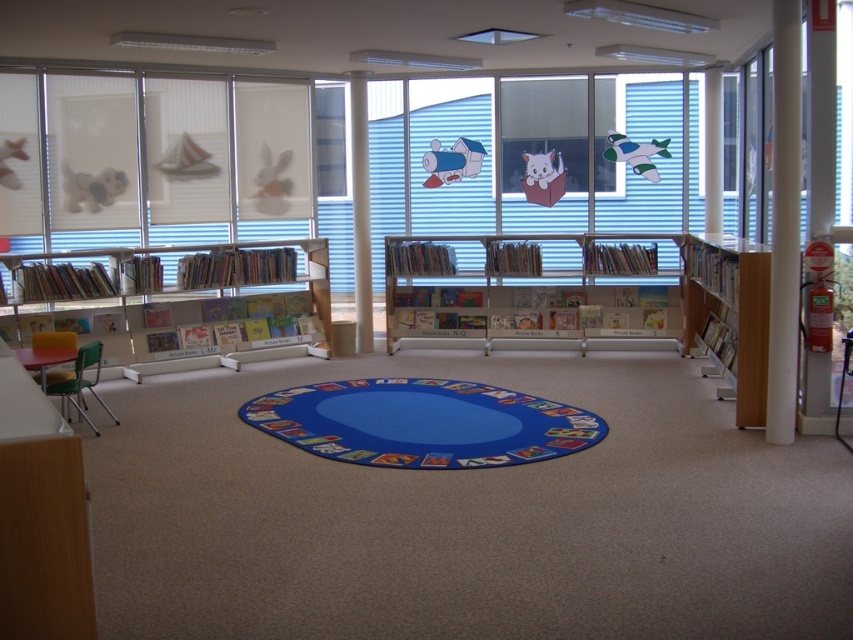
Who is lower down, matte white teddy bear at left or white matte rabbit at upper center?

Positioned lower is matte white teddy bear at left.

Locate an element on the screen. The image size is (853, 640). matte white teddy bear at left is located at coordinates (90, 188).

Find the location of a particular element. The image size is (853, 640). matte white teddy bear at left is located at coordinates (90, 188).

Does white plush cat at center lie in front of white matte sailboat at upper left?

That is False.

Can you confirm if white plush cat at center is positioned to the right of white matte sailboat at upper left?

Indeed, white plush cat at center is positioned on the right side of white matte sailboat at upper left.

I want to click on white plush cat at center, so click(543, 177).

Where is `white plush cat at center`? The width and height of the screenshot is (853, 640). white plush cat at center is located at coordinates (543, 177).

Who is shorter, matte plastic mouse at center or white matte rabbit at upper center?

With less height is matte plastic mouse at center.

Does matte plastic mouse at center have a larger size compared to white matte rabbit at upper center?

Correct, matte plastic mouse at center is larger in size than white matte rabbit at upper center.

Is point (476, 156) more distant than point (265, 186)?

Yes.

What are the coordinates of `matte plastic mouse at center` in the screenshot? It's located at (451, 161).